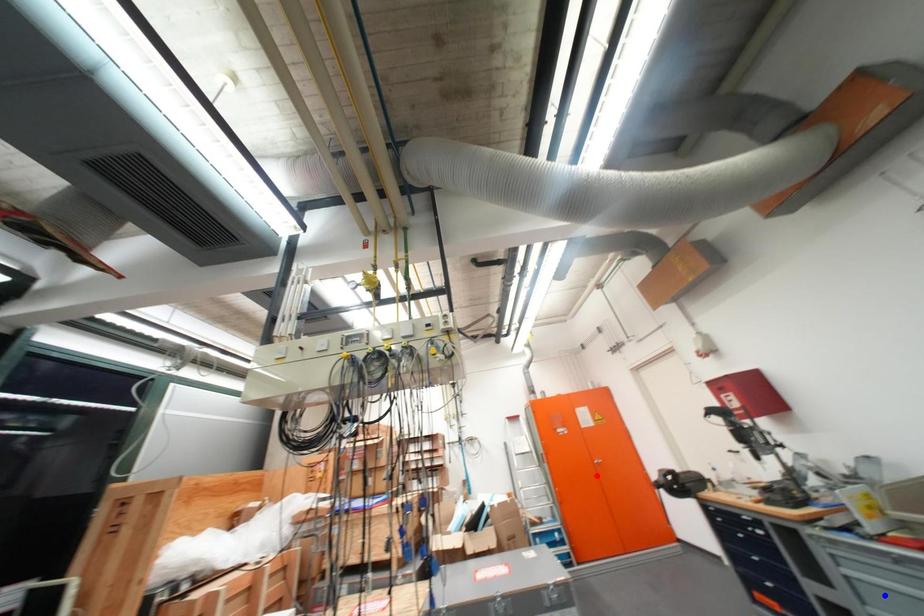
Question: Which of the two points in the image is closer to the camera?

Choices:
 (A) Blue point is closer.
 (B) Red point is closer.

Answer: (A)